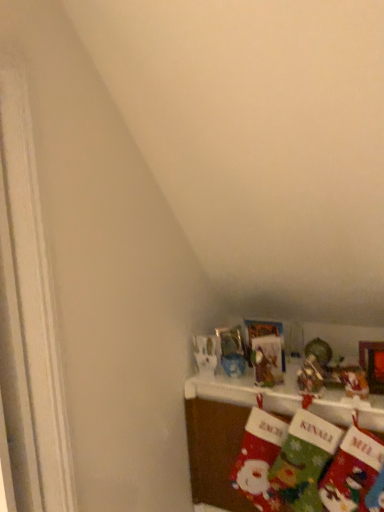
Question: Does red felt stocking at lower right, acting as the 3th sock starting from the right, have a greater height compared to velvet christmas stockings at lower right?

Choices:
 (A) yes
 (B) no

Answer: (B)

Question: From the image's perspective, is red felt stocking at lower right, acting as the 3th sock starting from the right, beneath velvet christmas stockings at lower right?

Choices:
 (A) no
 (B) yes

Answer: (A)

Question: From a real-world perspective, is red felt stocking at lower right, acting as the 3th sock starting from the right, on top of velvet christmas stockings at lower right?

Choices:
 (A) no
 (B) yes

Answer: (B)

Question: Is red felt stocking at lower right, acting as the 1th sock starting from the left, not within velvet christmas stockings at lower right?

Choices:
 (A) no
 (B) yes

Answer: (A)

Question: Is red felt stocking at lower right, acting as the 1th sock starting from the left, aimed at velvet christmas stockings at lower right?

Choices:
 (A) yes
 (B) no

Answer: (B)

Question: Is red felt stocking at lower right, acting as the 3th sock starting from the right, at the left side of velvet christmas stockings at lower right?

Choices:
 (A) no
 (B) yes

Answer: (B)

Question: Is green felt stocking at lower right, the first sock in the right-to-left sequence, surrounding metallic silver ornament at upper center, the 2th toy from the right?

Choices:
 (A) no
 (B) yes

Answer: (A)

Question: Does green felt stocking at lower right, placed as the 3th sock when sorted from left to right, have a lesser height compared to metallic silver ornament at upper center, the 2th toy from the right?

Choices:
 (A) yes
 (B) no

Answer: (B)

Question: Considering the relative sizes of green felt stocking at lower right, placed as the 3th sock when sorted from left to right, and metallic silver ornament at upper center, the 1th toy in the left-to-right sequence, in the image provided, is green felt stocking at lower right, placed as the 3th sock when sorted from left to right, wider than metallic silver ornament at upper center, the 1th toy in the left-to-right sequence,?

Choices:
 (A) no
 (B) yes

Answer: (B)

Question: Considering the relative positions of green felt stocking at lower right, the first sock in the right-to-left sequence, and metallic silver ornament at upper center, the 2th toy from the right, in the image provided, is green felt stocking at lower right, the first sock in the right-to-left sequence, to the right of metallic silver ornament at upper center, the 2th toy from the right, from the viewer's perspective?

Choices:
 (A) yes
 (B) no

Answer: (A)

Question: Is green felt stocking at lower right, the first sock in the right-to-left sequence, thinner than metallic silver ornament at upper center, the 1th toy in the left-to-right sequence?

Choices:
 (A) yes
 (B) no

Answer: (B)

Question: Is green felt stocking at lower right, placed as the 3th sock when sorted from left to right, further to the viewer compared to metallic silver ornament at upper center, the 1th toy in the left-to-right sequence?

Choices:
 (A) no
 (B) yes

Answer: (A)

Question: Is red felt stocking at lower right, acting as the 3th sock starting from the right, surrounding shiny metallic ornament at upper right, the 2th toy in the left-to-right sequence?

Choices:
 (A) no
 (B) yes

Answer: (A)